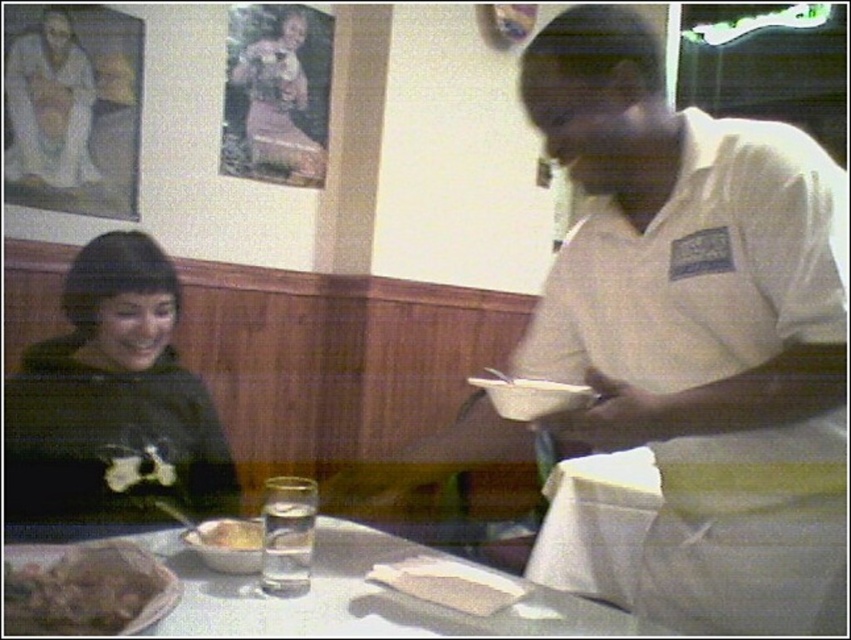
Question: Among these objects, which one is farthest from the camera?

Choices:
 (A) white uniform at right
 (B) black matte jacket at left

Answer: (B)

Question: Does white uniform at right appear on the left side of brown crumbly bread at lower left?

Choices:
 (A) no
 (B) yes

Answer: (A)

Question: Does white uniform at right appear on the left side of yellowish matte rice bowl at lower left?

Choices:
 (A) no
 (B) yes

Answer: (A)

Question: Can you confirm if black matte jacket at left is positioned to the left of brown crumbly bread at lower left?

Choices:
 (A) no
 (B) yes

Answer: (B)

Question: Considering the real-world distances, which object is closest to the matte white shirt at upper left?

Choices:
 (A) white uniform at right
 (B) yellowish matte rice bowl at lower left

Answer: (B)

Question: Among these points, which one is nearest to the camera?

Choices:
 (A) (783, 280)
 (B) (256, 529)
 (C) (9, 605)

Answer: (C)